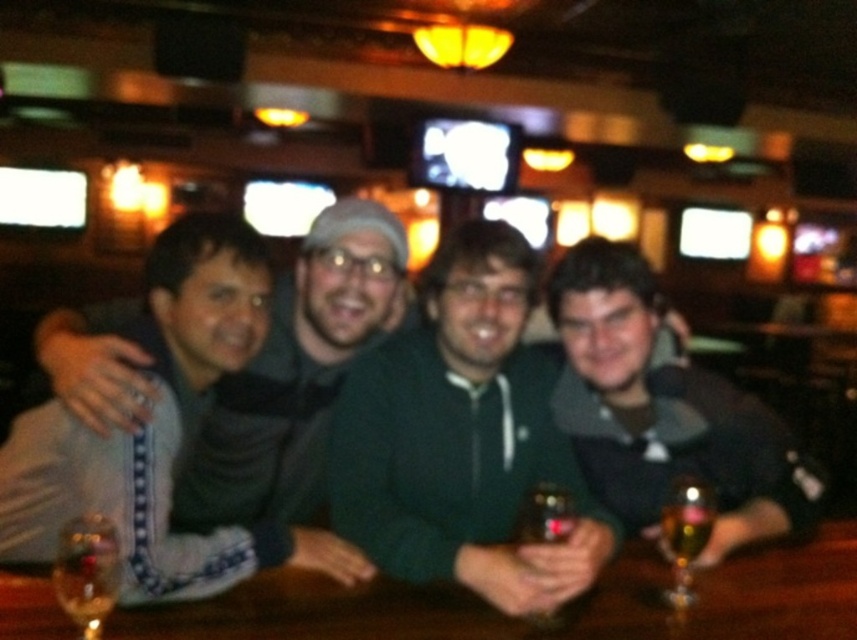
Is brown wooden table at center closer to camera compared to translucent glass wine at lower left?

No, it is behind translucent glass wine at lower left.

Is point (465, 616) farther from camera compared to point (69, 524)?

Yes, point (465, 616) is farther from viewer.

Identify the location of brown wooden table at center. The image size is (857, 640). (528, 625).

Which is behind, point (250, 483) or point (836, 602)?

Point (250, 483)

What do you see at coordinates (297, 372) in the screenshot? I see `green fleece jacket at center` at bounding box center [297, 372].

The width and height of the screenshot is (857, 640). Identify the location of green fleece jacket at center. (297, 372).

Looking at this image, can you confirm if green fleece jacket at center is positioned to the right of translucent glass wine at lower left?

Yes, green fleece jacket at center is to the right of translucent glass wine at lower left.

Is the position of green fleece jacket at center less distant than that of translucent glass wine at lower left?

No, it is not.

Where is `green fleece jacket at center`? Image resolution: width=857 pixels, height=640 pixels. green fleece jacket at center is located at coordinates (297, 372).